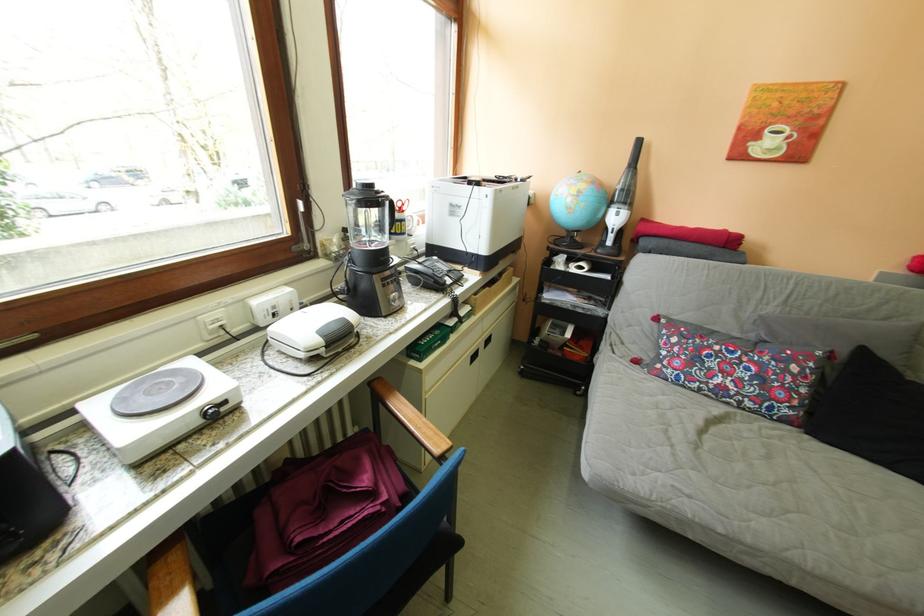
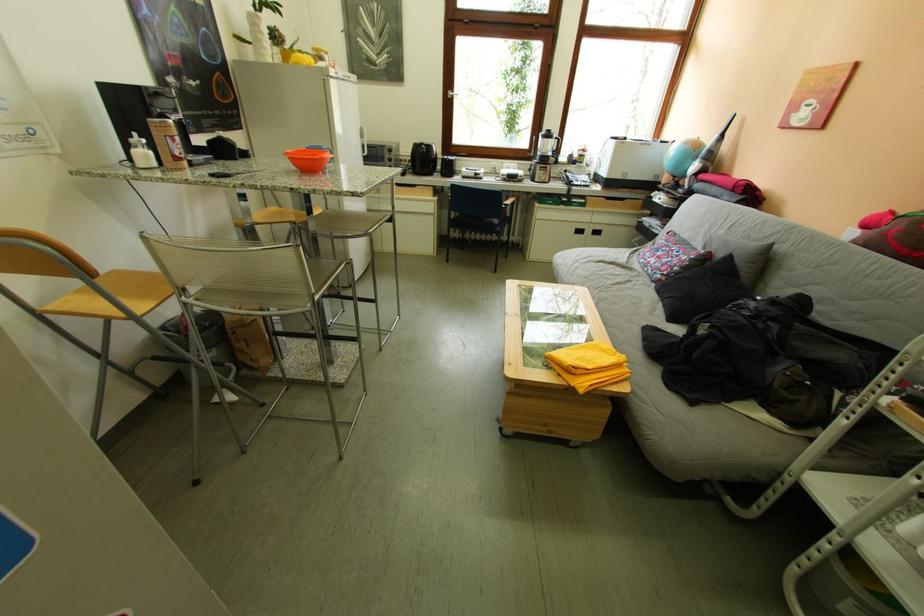
In the second image, find the point that corresponds to [824,368] in the first image.

(706, 259)